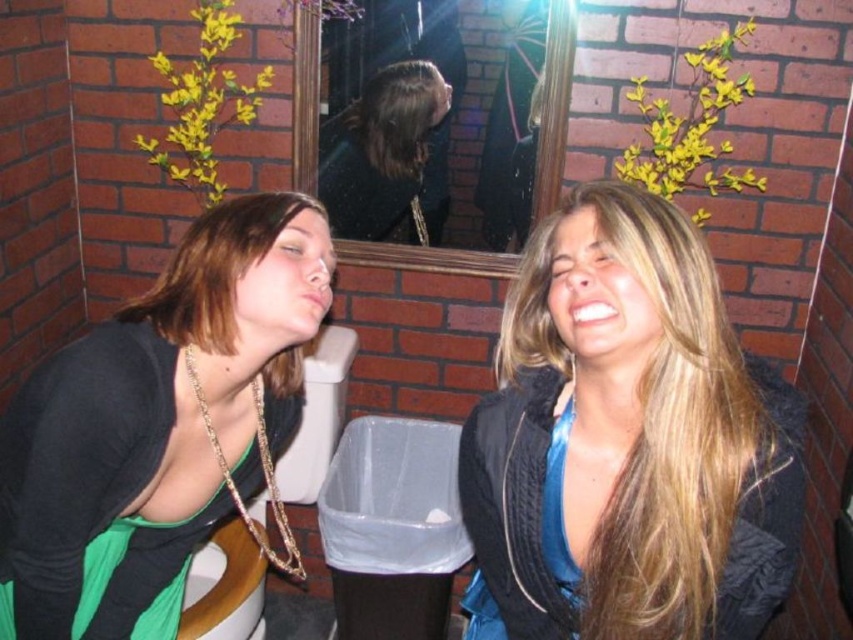
Question: Is blue satin blouse at center above shiny black hair at center?

Choices:
 (A) yes
 (B) no

Answer: (B)

Question: Is blue satin blouse at center smaller than green fabric top at left?

Choices:
 (A) no
 (B) yes

Answer: (B)

Question: Which of the following is the farthest from the observer?

Choices:
 (A) (286, 256)
 (B) (422, 157)
 (C) (782, 500)

Answer: (B)

Question: Can you confirm if green fabric top at left is positioned above shiny black hair at center?

Choices:
 (A) yes
 (B) no

Answer: (B)

Question: Which of these objects is positioned closest to the shiny black hair at center?

Choices:
 (A) green fabric top at left
 (B) blue satin blouse at center

Answer: (A)

Question: Which point is farther to the camera?

Choices:
 (A) green fabric top at left
 (B) blue satin blouse at center

Answer: (A)